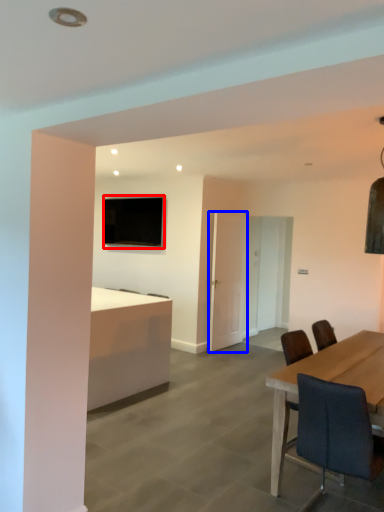
Question: Which object is closer to the camera taking this photo, television (highlighted by a red box) or glass door (highlighted by a blue box)?

Choices:
 (A) television
 (B) glass door

Answer: (B)